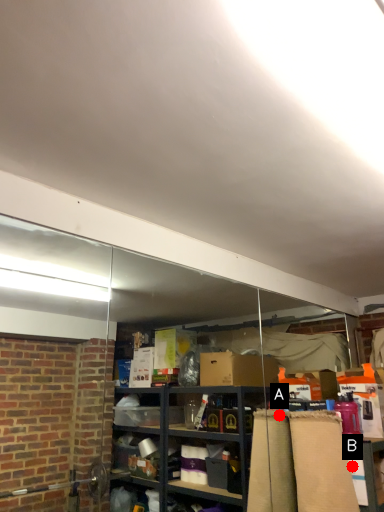
Question: Two points are circled on the image, labeled by A and B beside each circle. Among these points, which one is farthest from the camera?

Choices:
 (A) A is further
 (B) B is further

Answer: (A)